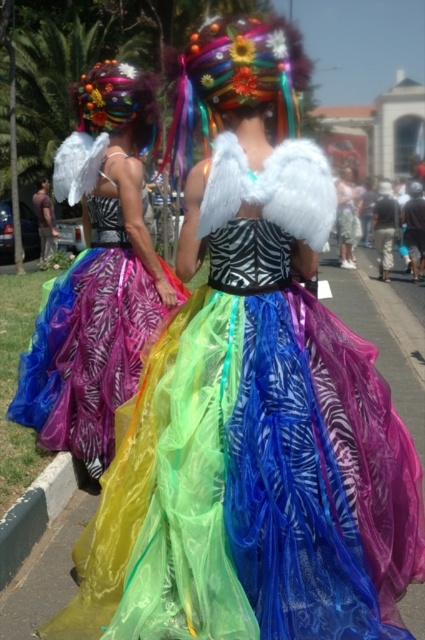
You are a photographer standing at the edge of the street. You want to take a photo of the matte white wings at center without including the green rubber curb at lower left in the frame. Is this possible based on their positions?

The green rubber curb at lower left is positioned under the matte white wings at center, so if you position yourself to capture the matte white wings at center from above or adjust your angle to avoid the lower area where the curb is located, you can exclude the green rubber curb at lower left from the frame.

You are a photographer trying to capture the shiny multicolored dress at center and the green rubber curb at lower left in a single shot. Based on their positions, which object is closer to the camera?

The shiny multicolored dress at center is closer to the camera than the green rubber curb at lower left.

You are a photographer trying to capture a photo of the shiny multicolored dress at center and the green rubber curb at lower left. Based on their sizes in the image, which object should you focus on first if you want to ensure both are in focus?

The shiny multicolored dress at center is much taller than the green rubber curb at lower left, so you should focus on the shiny multicolored dress at center first to ensure both are in focus.